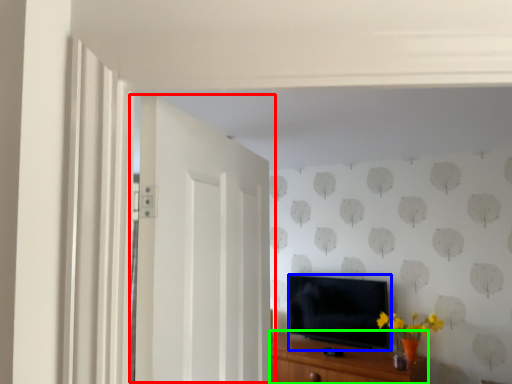
Question: Which object is positioned farthest from door (highlighted by a red box)? Select from television (highlighted by a blue box) and cabinetry (highlighted by a green box).

Choices:
 (A) television
 (B) cabinetry

Answer: (A)